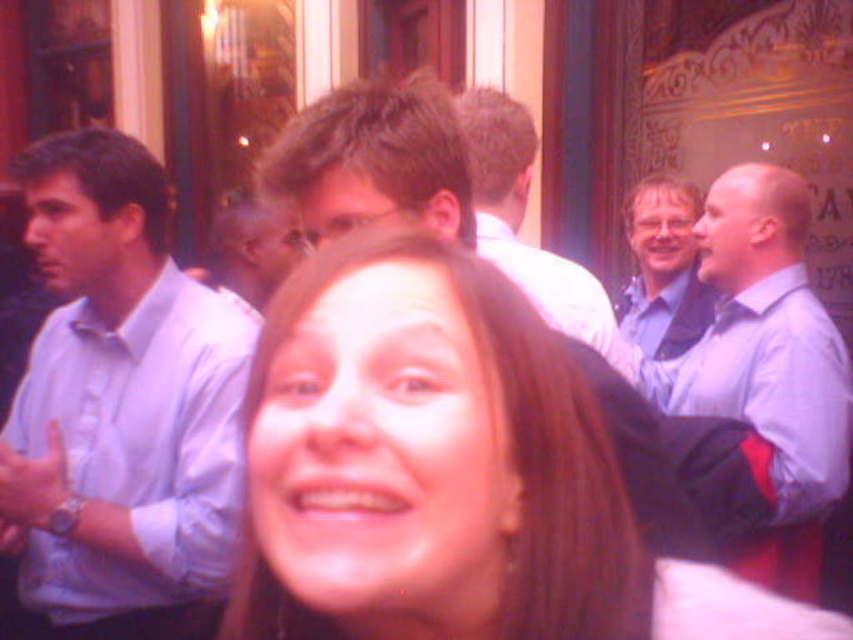
Question: Can you confirm if light blue shirt at left is positioned to the right of light blue shirt at right?

Choices:
 (A) yes
 (B) no

Answer: (B)

Question: Which is nearer to the smooth skin face at center?

Choices:
 (A) matte white shirt at center
 (B) light blue shirt at left

Answer: (A)

Question: Which point is closer to the camera taking this photo?

Choices:
 (A) (770, 189)
 (B) (495, 118)
 (C) (712, 300)
 (D) (378, 276)

Answer: (D)

Question: Does matte white shirt at center have a lesser width compared to blue shirt at center?

Choices:
 (A) no
 (B) yes

Answer: (A)

Question: Among these objects, which one is farthest from the camera?

Choices:
 (A) blue shirt at center
 (B) matte white shirt at center
 (C) light blue shirt at left
 (D) light blue shirt at right

Answer: (A)

Question: Can you confirm if light blue shirt at right is positioned below matte white shirt at center?

Choices:
 (A) no
 (B) yes

Answer: (B)